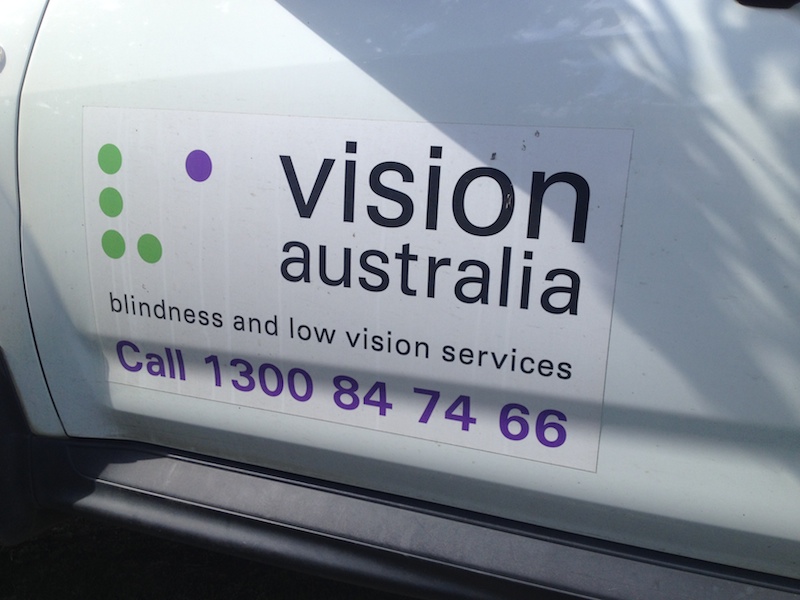
Where is `door`? The image size is (800, 600). door is located at coordinates (118, 113).